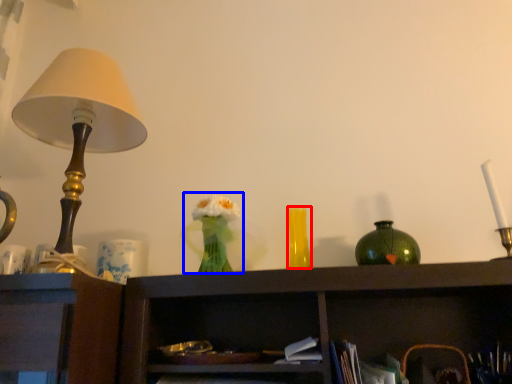
Question: Which of the following is the farthest to the observer, vase (highlighted by a red box) or floral arrangement (highlighted by a blue box)?

Choices:
 (A) vase
 (B) floral arrangement

Answer: (A)